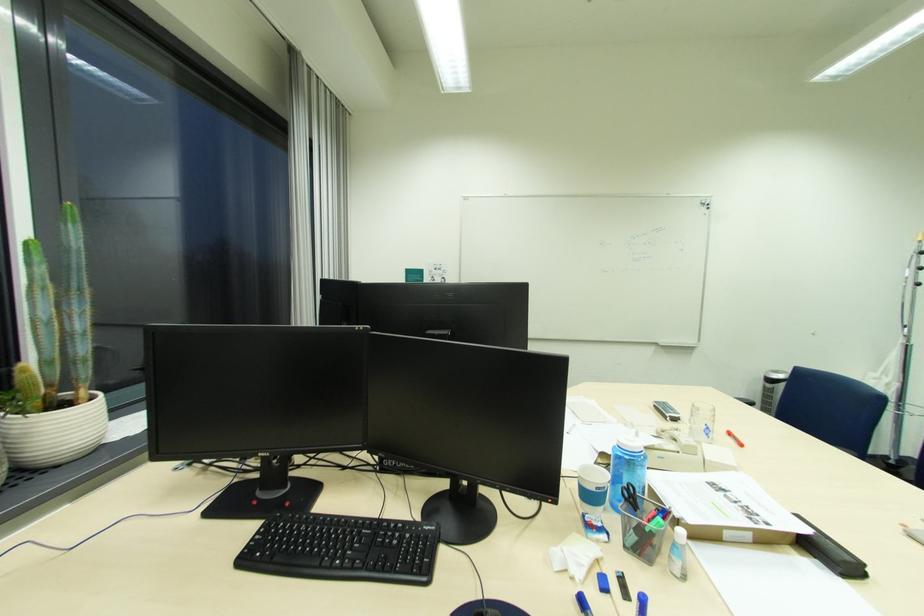
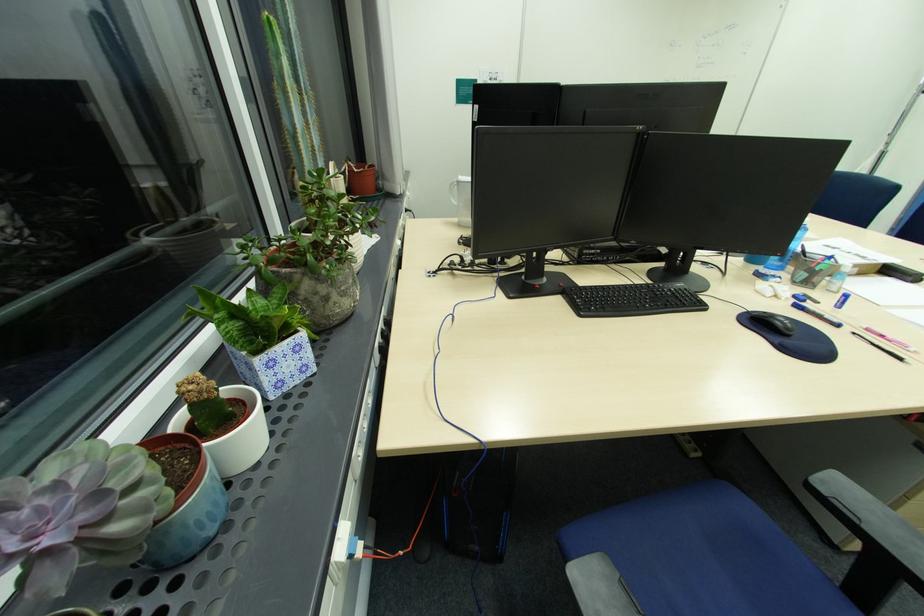
Question: In a continuous first-person perspective shot, in which direction is the camera moving?

Choices:
 (A) Left
 (B) Right
 (C) Forward
 (D) Backward

Answer: (A)